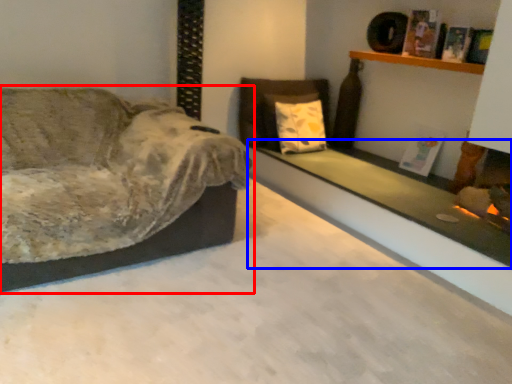
Question: Which object appears farthest to the camera in this image, studio couch (highlighted by a red box) or ledge (highlighted by a blue box)?

Choices:
 (A) studio couch
 (B) ledge

Answer: (B)